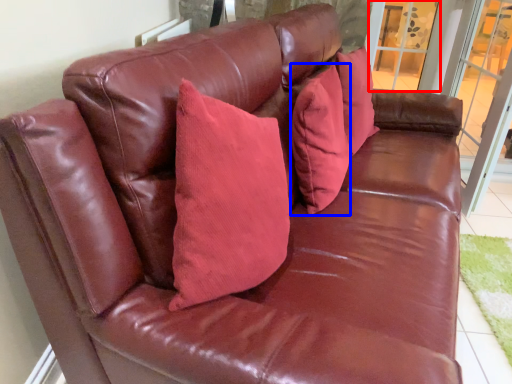
Question: Among these objects, which one is farthest to the camera, window (highlighted by a red box) or pillow (highlighted by a blue box)?

Choices:
 (A) window
 (B) pillow

Answer: (A)